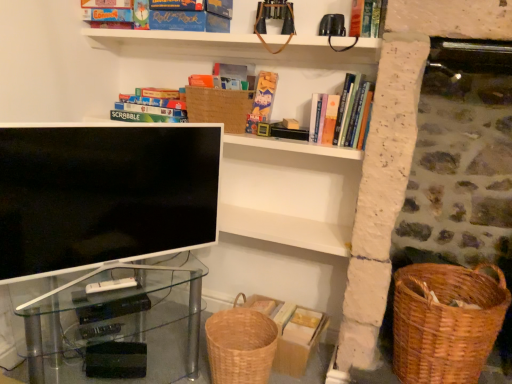
Question: From a real-world perspective, is matte cardboard scrabble board game at upper left, which is the fourth book from right to left, located higher than woven brown basket at upper center?

Choices:
 (A) no
 (B) yes

Answer: (A)

Question: Is woven brown basket at upper center at the back of matte cardboard scrabble board game at upper left, which is the first book from left to right?

Choices:
 (A) yes
 (B) no

Answer: (B)

Question: Is matte cardboard scrabble board game at upper left, which is the first book from left to right, in contact with woven brown basket at upper center?

Choices:
 (A) no
 (B) yes

Answer: (A)

Question: Does matte cardboard scrabble board game at upper left, which is the fourth book from right to left, appear on the left side of woven brown basket at upper center?

Choices:
 (A) no
 (B) yes

Answer: (B)

Question: Considering the relative sizes of matte cardboard scrabble board game at upper left, which is the first book from left to right, and woven brown basket at upper center in the image provided, is matte cardboard scrabble board game at upper left, which is the first book from left to right, thinner than woven brown basket at upper center?

Choices:
 (A) yes
 (B) no

Answer: (B)

Question: Does matte cardboard scrabble board game at upper left, which is the fourth book from right to left, have a smaller size compared to woven brown basket at upper center?

Choices:
 (A) yes
 (B) no

Answer: (A)

Question: Does matte white tv at center have a lesser height compared to matte cardboard book at upper center, positioned as the third book in right-to-left order?

Choices:
 (A) no
 (B) yes

Answer: (A)

Question: Is matte white tv at center not inside matte cardboard book at upper center, positioned as the third book in right-to-left order?

Choices:
 (A) no
 (B) yes

Answer: (B)

Question: Considering the relative sizes of matte white tv at center and matte cardboard book at upper center, positioned as the third book in right-to-left order, in the image provided, is matte white tv at center bigger than matte cardboard book at upper center, positioned as the third book in right-to-left order,?

Choices:
 (A) yes
 (B) no

Answer: (A)

Question: Is matte white tv at center surrounding matte cardboard book at upper center, the second book in the left-to-right sequence?

Choices:
 (A) no
 (B) yes

Answer: (A)

Question: Is matte white tv at center oriented towards matte cardboard book at upper center, positioned as the third book in right-to-left order?

Choices:
 (A) no
 (B) yes

Answer: (A)

Question: From the image's perspective, is matte white tv at center below matte cardboard book at upper center, positioned as the third book in right-to-left order?

Choices:
 (A) yes
 (B) no

Answer: (A)

Question: Does transparent glass computer desk at lower left turn towards woven brown basket at upper center?

Choices:
 (A) no
 (B) yes

Answer: (A)